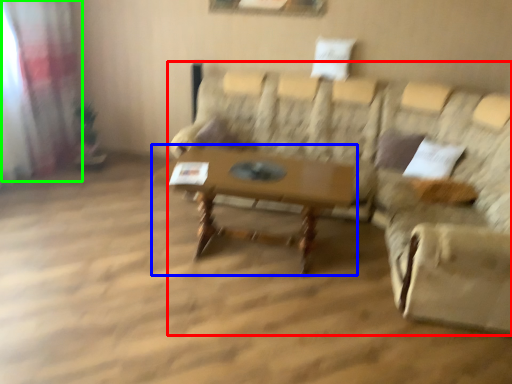
Question: Based on their relative distances, which object is farther from studio couch (highlighted by a red box)? Choose from table (highlighted by a blue box) and curtain (highlighted by a green box).

Choices:
 (A) table
 (B) curtain

Answer: (B)